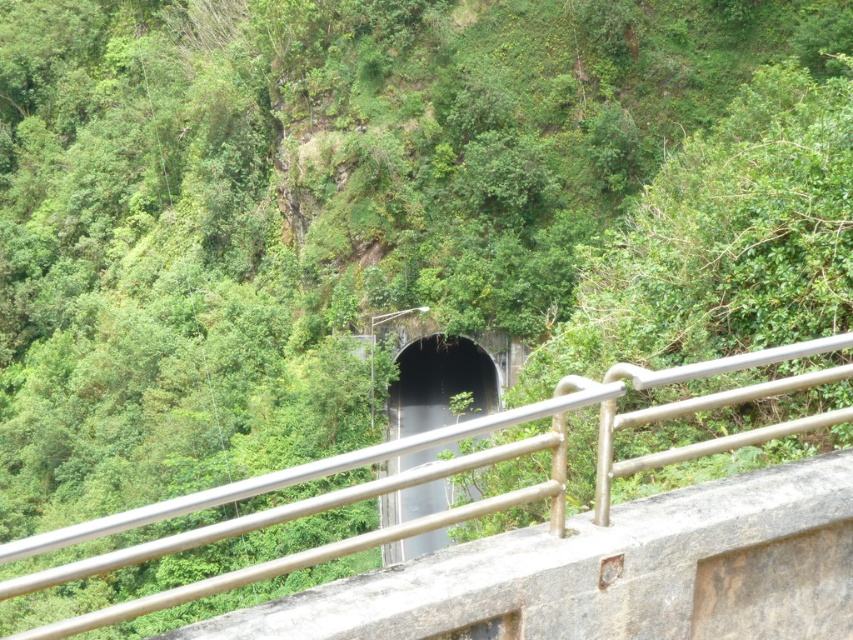
Question: In this image, where is metallic gray rail at center located relative to black concrete tunnel at center?

Choices:
 (A) right
 (B) left

Answer: (A)

Question: Which point appears farthest from the camera in this image?

Choices:
 (A) (415, 356)
 (B) (576, 384)

Answer: (A)

Question: Which point is farther to the camera?

Choices:
 (A) black concrete tunnel at center
 (B) metallic gray rail at center

Answer: (A)

Question: Considering the relative positions of metallic gray rail at center and black concrete tunnel at center in the image provided, where is metallic gray rail at center located with respect to black concrete tunnel at center?

Choices:
 (A) above
 (B) below

Answer: (A)

Question: Which object appears closest to the camera in this image?

Choices:
 (A) black concrete tunnel at center
 (B) metallic gray rail at center

Answer: (B)

Question: Is metallic gray rail at center to the right of black concrete tunnel at center from the viewer's perspective?

Choices:
 (A) no
 (B) yes

Answer: (B)